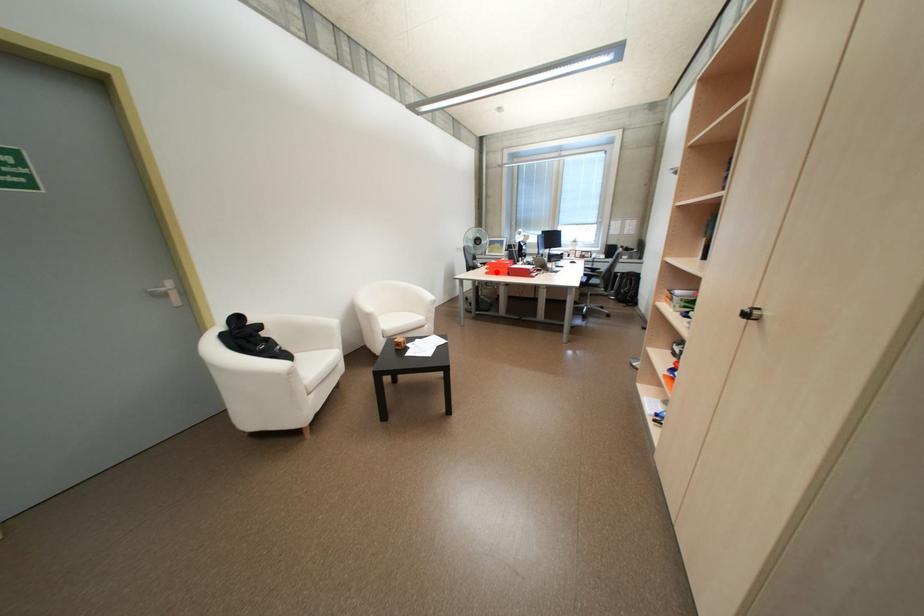
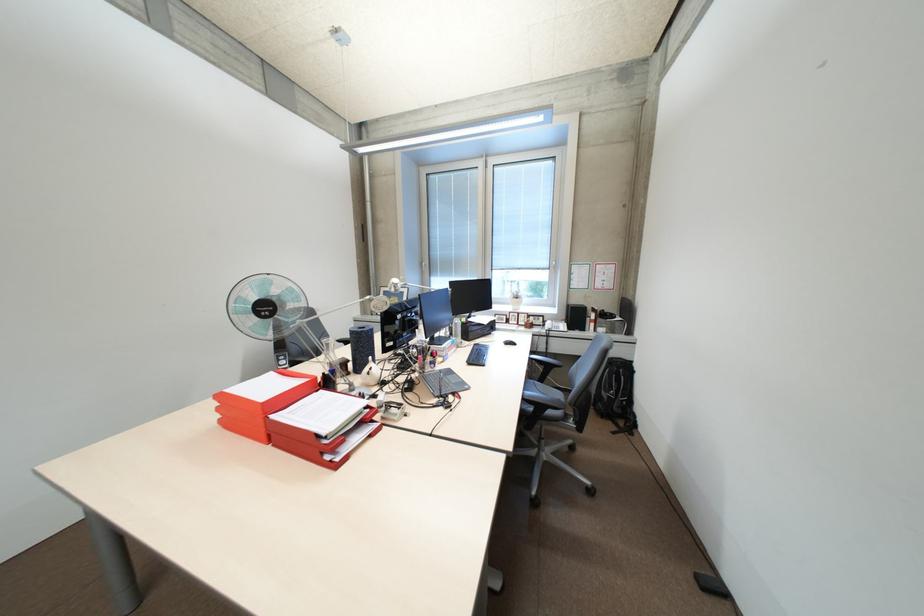
Question: I am providing you with two images of the same scene from different viewpoints. In image1, a red point is highlighted. Considering the same 3D point in image2, which of the following is correct?

Choices:
 (A) It is closer
 (B) It is farther

Answer: (B)